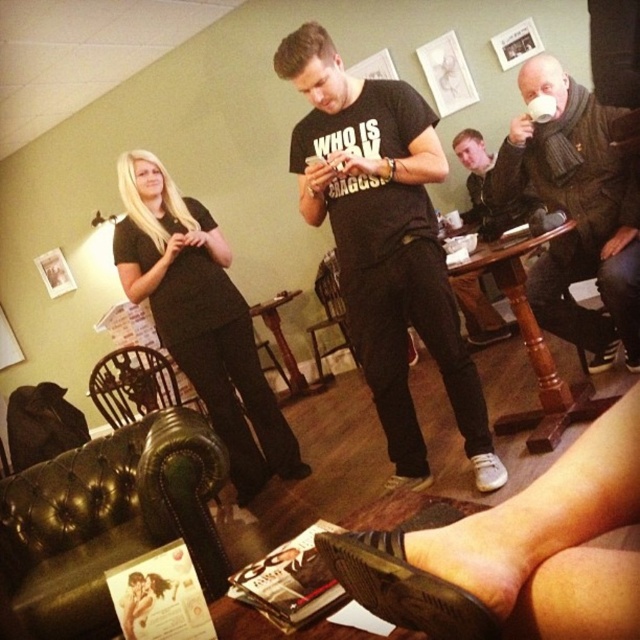
Question: Which object is closer to the camera taking this photo?

Choices:
 (A) wooden chair at lower left
 (B) white ceramic cup at upper right

Answer: (B)

Question: Can you confirm if green leather armchair at lower left is thinner than wooden chair at lower left?

Choices:
 (A) no
 (B) yes

Answer: (B)

Question: Considering the real-world distances, which object is farthest from the white ceramic cup at upper right?

Choices:
 (A) knitted scarf at upper right
 (B) black leather armchair at center
 (C) dark brown leather jacket at right

Answer: (B)

Question: Is black cotton t-shirt at center to the right of black leather armchair at center from the viewer's perspective?

Choices:
 (A) yes
 (B) no

Answer: (A)

Question: In this image, where is black cotton t-shirt at center located relative to dark brown leather jacket at right?

Choices:
 (A) below
 (B) above

Answer: (A)

Question: Which object is closer to the camera taking this photo?

Choices:
 (A) green leather armchair at lower left
 (B) black leather armchair at center
 (C) dark brown leather jacket at right
 (D) knitted scarf at upper right

Answer: (A)